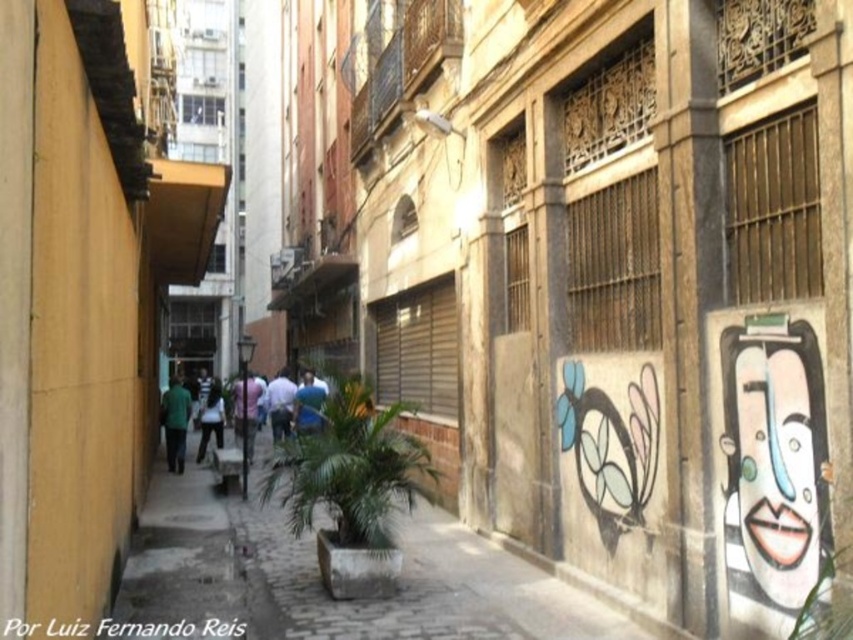
Who is lower down, brown concrete pavement at center or white glossy face at right?

brown concrete pavement at center

Is brown concrete pavement at center bigger than white glossy face at right?

Correct, brown concrete pavement at center is larger in size than white glossy face at right.

Describe the element at coordinates (358, 600) in the screenshot. I see `brown concrete pavement at center` at that location.

Where is `brown concrete pavement at center`? The height and width of the screenshot is (640, 853). brown concrete pavement at center is located at coordinates (358, 600).

Can you confirm if white glossy face at right is positioned below blue shirt at center?

No, white glossy face at right is not below blue shirt at center.

Does white glossy face at right have a lesser width compared to blue shirt at center?

Indeed, white glossy face at right has a lesser width compared to blue shirt at center.

Is point (747, 413) farther from camera compared to point (283, 401)?

No, (747, 413) is in front of (283, 401).

This screenshot has height=640, width=853. In order to click on white glossy face at right in this screenshot , I will do `click(776, 472)`.

Does point (479, 556) come farther from viewer compared to point (297, 422)?

That is False.

Who is positioned more to the left, brown concrete pavement at center or blue fabric shirt at center?

blue fabric shirt at center

Identify the location of brown concrete pavement at center. (358, 600).

Identify the location of brown concrete pavement at center. (358, 600).